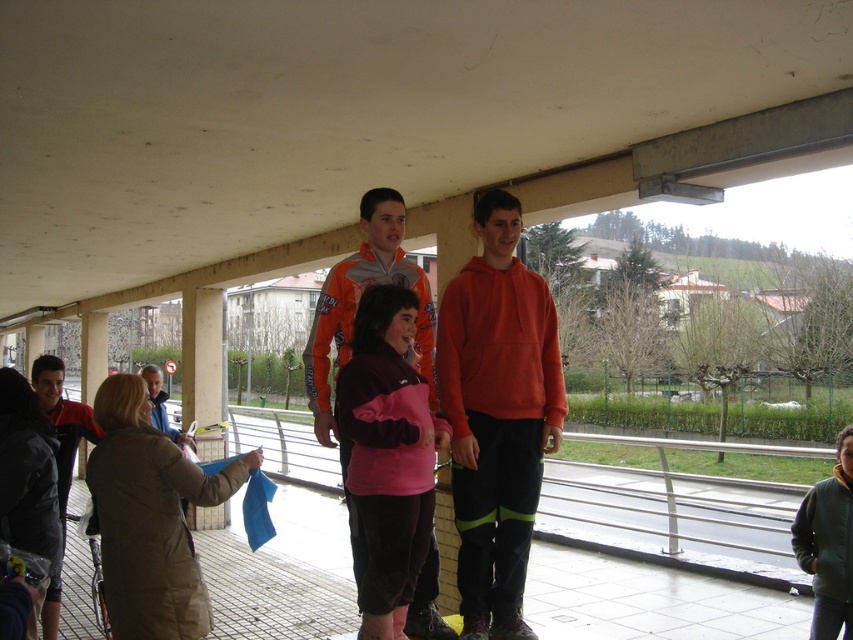
What is the color of the clothing item at the point with coordinates (497,413)?

The point (497,413) is on orange fleece at center, so the color is orange.